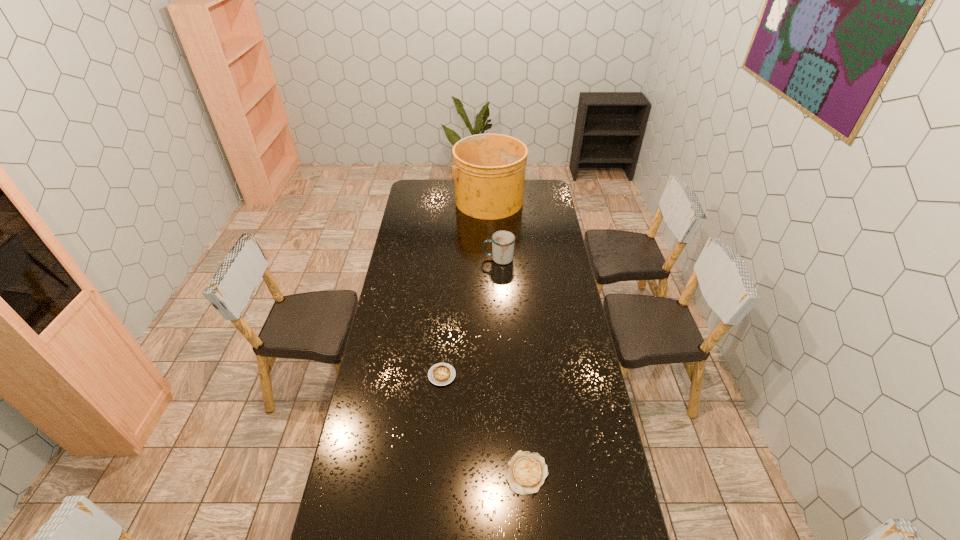
The height and width of the screenshot is (540, 960). What are the coordinates of `object that ranks as the second closest to the tallest object` in the screenshot? It's located at (440, 374).

Identify the location of vacant space that satisfies the following two spatial constraints: 1. on the handle side of the mug; 2. on the front side of the left quiche. (504, 375).

This screenshot has width=960, height=540. Identify the location of vacant space that satisfies the following two spatial constraints: 1. on the handle side of the third nearest object; 2. on the front side of the left quiche. (504, 375).

Find the location of a particular element. The width and height of the screenshot is (960, 540). free space that satisfies the following two spatial constraints: 1. on the handle side of the right quiche; 2. on the left side of the second tallest object is located at coordinates (509, 472).

Where is `free location that satisfies the following two spatial constraints: 1. on the handle side of the third shortest object; 2. on the front side of the farther quiche`? Image resolution: width=960 pixels, height=540 pixels. free location that satisfies the following two spatial constraints: 1. on the handle side of the third shortest object; 2. on the front side of the farther quiche is located at coordinates (504, 375).